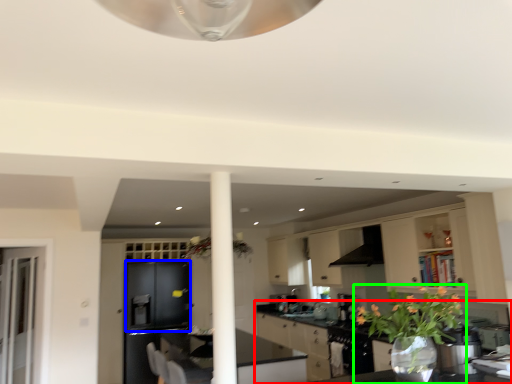
Question: Estimate the real-world distances between objects in this image. Which object is farther from countertop (highlighted by a red box), cabinetry (highlighted by a blue box) or houseplant (highlighted by a green box)?

Choices:
 (A) cabinetry
 (B) houseplant

Answer: (B)